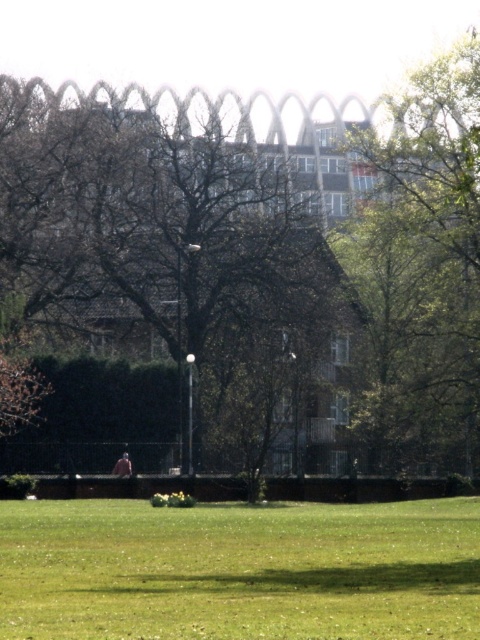
You are standing at the edge of the park and see the green grass at lower center and the light brown fabric person at center. If you want to walk from the grass to the person, will you have to walk across the grass or around it?

Result: The green grass at lower center is wider than the light brown fabric person at center, so you would have to walk across the grass to reach the person.

You are standing in the park and want to take a photo of the light brown fabric person at center without the green leafy tree at upper right blocking the view. Which direction should you move to ensure the tree is out of frame?

Move downward or to the lower part of the park to position yourself below the light brown fabric person at center so the green leafy tree at upper right is no longer above and blocking the view.